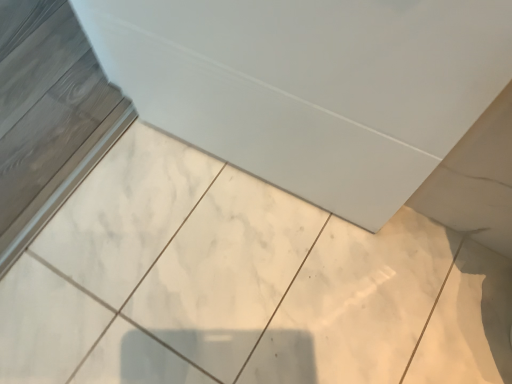
The height and width of the screenshot is (384, 512). What do you see at coordinates (51, 126) in the screenshot? I see `white glossy window at lower left` at bounding box center [51, 126].

Locate an element on the screen. This screenshot has height=384, width=512. white glossy window at lower left is located at coordinates (51, 126).

In order to click on white glossy window at lower left in this screenshot , I will do `click(51, 126)`.